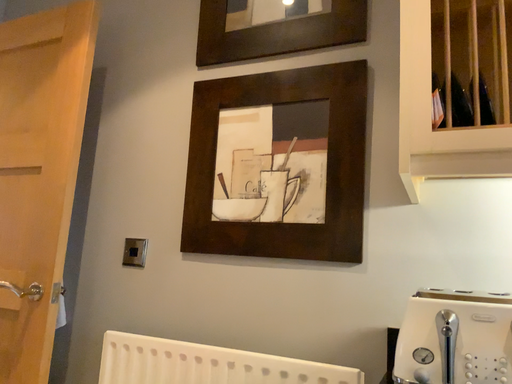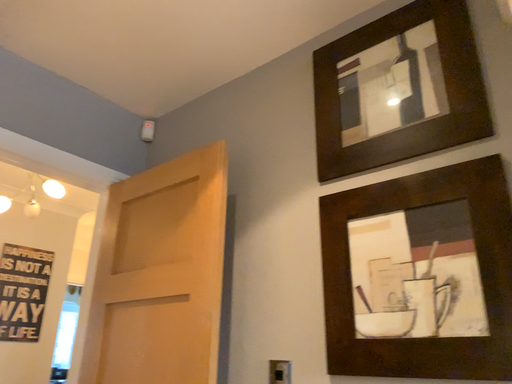
Question: Which way did the camera rotate in the video?

Choices:
 (A) rotated downward
 (B) rotated upward

Answer: (B)